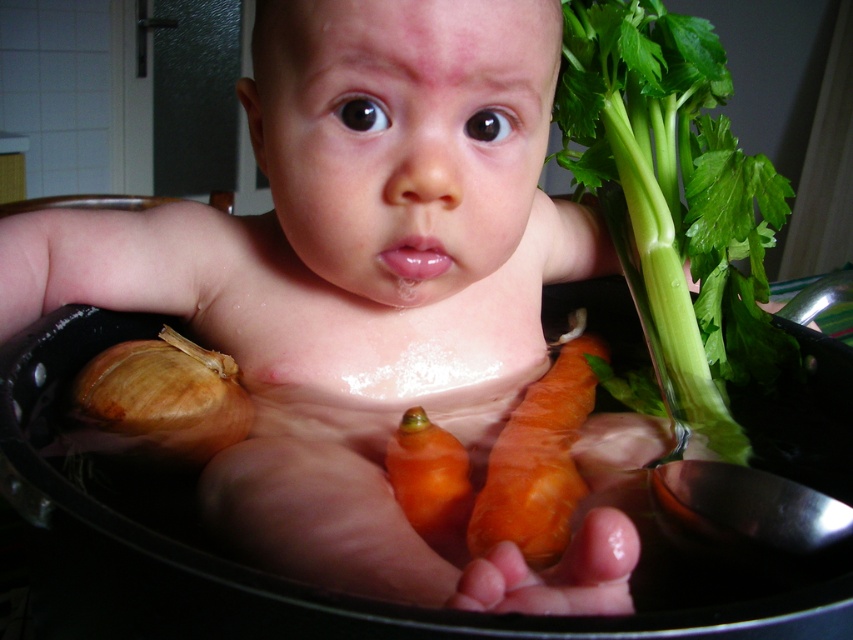
You are a chef preparing a soup and need to locate the brown matte onion at lower left in the pot. What are its coordinates?

The brown matte onion at lower left is located at coordinates point [160,401].

You are a chef preparing a soup and need to retrieve the brown matte onion at lower left from the pot. The pot contains the orange smooth carrot at center. Which vegetable should you move first to access the onion?

The brown matte onion at lower left is located above the orange smooth carrot at center, so you should move the orange smooth carrot at center first to access the onion.

You are a chef trying to reach the vegetables in the pot. You see two points in the pot labeled as point (711, 285) and point (402, 474). Which point is closer to you?

Point (402, 474) is closer to you because it is less further to the viewer than point (711, 285).